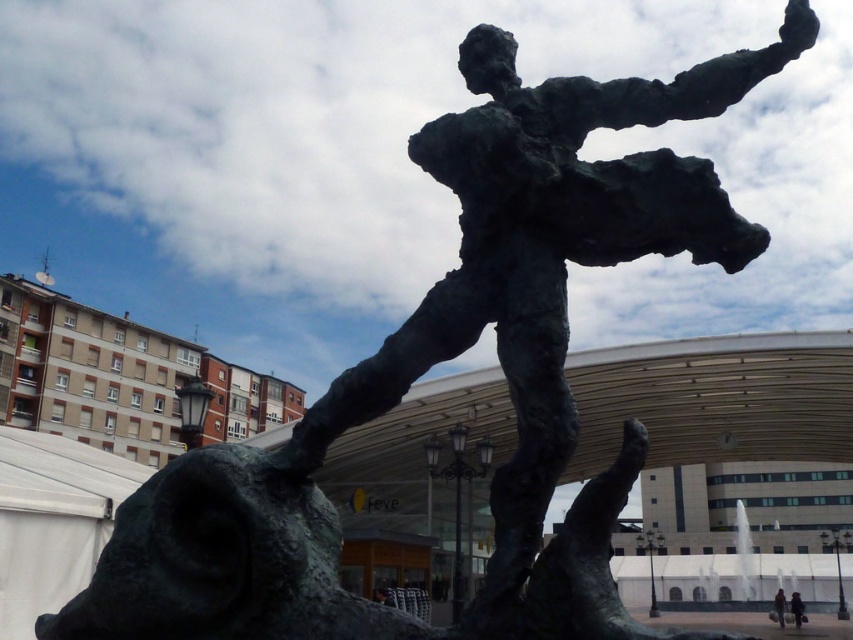
Question: Which point appears farthest from the camera in this image?

Choices:
 (A) (782, 589)
 (B) (804, 614)

Answer: (A)

Question: Is dark brown leather jacket at lower right bigger than dark gray fabric bag at lower right?

Choices:
 (A) no
 (B) yes

Answer: (A)

Question: Can you confirm if dark brown leather jacket at lower right is positioned below dark gray fabric bag at lower right?

Choices:
 (A) yes
 (B) no

Answer: (B)

Question: Which of the following is the farthest from the observer?

Choices:
 (A) (798, 625)
 (B) (775, 595)

Answer: (B)

Question: Is dark brown leather jacket at lower right wider than dark gray fabric bag at lower right?

Choices:
 (A) yes
 (B) no

Answer: (B)